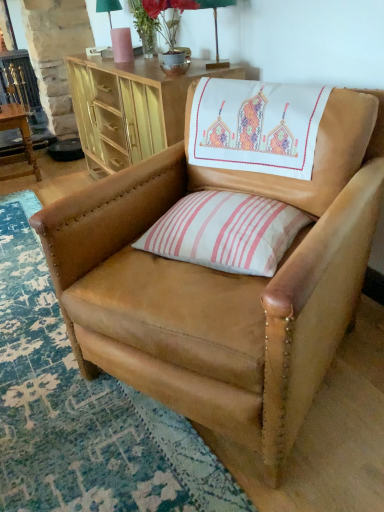
This screenshot has height=512, width=384. I want to click on vacant area located to the right-hand side of wooden table at lower left, so 73,174.